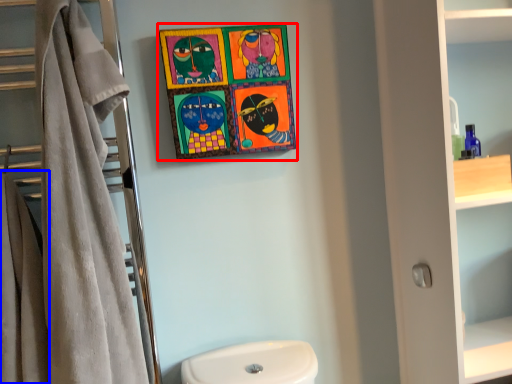
Question: Among these objects, which one is farthest to the camera, picture frame (highlighted by a red box) or bath towel (highlighted by a blue box)?

Choices:
 (A) picture frame
 (B) bath towel

Answer: (A)